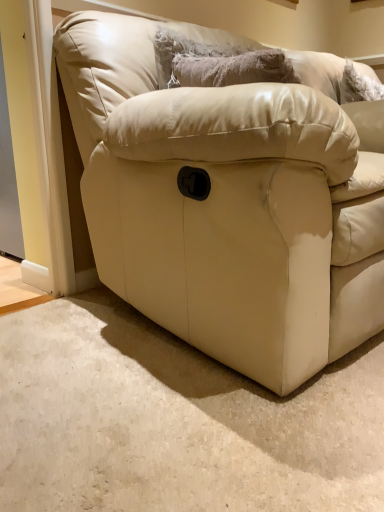
Question: Is matte leather couch at center smaller than fuzzy gray pillow at upper center?

Choices:
 (A) yes
 (B) no

Answer: (B)

Question: Is matte leather couch at center wider than fuzzy gray pillow at upper center?

Choices:
 (A) no
 (B) yes

Answer: (B)

Question: Is fuzzy gray pillow at upper center surrounded by matte leather couch at center?

Choices:
 (A) no
 (B) yes

Answer: (B)

Question: From a real-world perspective, is matte leather couch at center under fuzzy gray pillow at upper center?

Choices:
 (A) yes
 (B) no

Answer: (A)

Question: From the image's perspective, does matte leather couch at center appear lower than fuzzy gray pillow at upper center?

Choices:
 (A) yes
 (B) no

Answer: (A)

Question: Is matte leather couch at center not near fuzzy gray pillow at upper center?

Choices:
 (A) yes
 (B) no

Answer: (B)

Question: Is fuzzy gray pillow at upper center positioned far away from matte leather couch at center?

Choices:
 (A) no
 (B) yes

Answer: (A)

Question: Can you confirm if fuzzy gray pillow at upper center is positioned to the left of matte leather couch at center?

Choices:
 (A) yes
 (B) no

Answer: (A)

Question: Considering the relative sizes of fuzzy gray pillow at upper center and matte leather couch at center in the image provided, is fuzzy gray pillow at upper center smaller than matte leather couch at center?

Choices:
 (A) no
 (B) yes

Answer: (B)

Question: From a real-world perspective, is fuzzy gray pillow at upper center on matte leather couch at center?

Choices:
 (A) no
 (B) yes

Answer: (B)

Question: From the image's perspective, is fuzzy gray pillow at upper center beneath matte leather couch at center?

Choices:
 (A) yes
 (B) no

Answer: (B)

Question: Is matte leather couch at center completely or partially inside fuzzy gray pillow at upper center?

Choices:
 (A) yes
 (B) no

Answer: (B)

Question: Is fuzzy gray pillow at upper center wider or thinner than matte leather couch at center?

Choices:
 (A) thin
 (B) wide

Answer: (A)